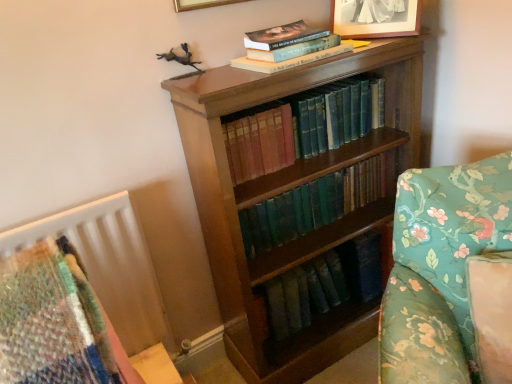
Question: Would you say floral fabric sofa at right is to the left or to the right of hardcover book at upper center, which is the first book in top-to-bottom order, in the picture?

Choices:
 (A) right
 (B) left

Answer: (A)

Question: In terms of width, does floral fabric sofa at right look wider or thinner when compared to hardcover book at upper center, which is the first book in top-to-bottom order?

Choices:
 (A) wide
 (B) thin

Answer: (A)

Question: Which object is positioned closest to the green leather book at center, arranged as the 3th book when viewed from the top?

Choices:
 (A) hardcover book at upper center, positioned as the third book in bottom-to-top order
 (B) floral fabric sofa at right
 (C) green leather book at center, placed as the second book when sorted from bottom to top
 (D) wooden bookcase at center
 (E) matte silver picture frame at upper center

Answer: (D)

Question: Based on their relative distances, which object is farther from the green leather book at center, arranged as the 3th book when viewed from the top?

Choices:
 (A) hardcover book at upper center, which is the first book in top-to-bottom order
 (B) matte silver picture frame at upper center
 (C) floral fabric sofa at right
 (D) green leather book at center, placed as the second book when sorted from bottom to top
 (E) wooden bookcase at center

Answer: (B)